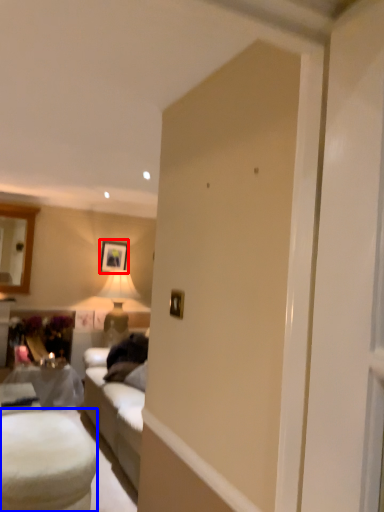
Question: Which object appears closest to the camera in this image, picture frame (highlighted by a red box) or table (highlighted by a blue box)?

Choices:
 (A) picture frame
 (B) table

Answer: (B)